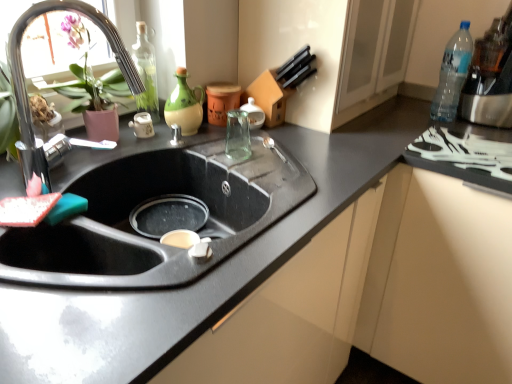
Question: Which direction should I rotate to face green matte jug at upper center, placed as the 2th bottle when sorted from right to left, — up or down?

Choices:
 (A) up
 (B) down

Answer: (A)

Question: From the image's perspective, does matte ceramic teapot at center appear higher than chrome metallic faucet at upper left?

Choices:
 (A) no
 (B) yes

Answer: (A)

Question: Is matte ceramic teapot at center positioned with its back to chrome metallic faucet at upper left?

Choices:
 (A) no
 (B) yes

Answer: (A)

Question: Is matte ceramic teapot at center smaller than chrome metallic faucet at upper left?

Choices:
 (A) yes
 (B) no

Answer: (A)

Question: Is chrome metallic faucet at upper left inside matte ceramic teapot at center?

Choices:
 (A) yes
 (B) no

Answer: (B)

Question: From the image's perspective, does matte ceramic teapot at center appear lower than chrome metallic faucet at upper left?

Choices:
 (A) no
 (B) yes

Answer: (B)

Question: Can you confirm if matte ceramic teapot at center is taller than chrome metallic faucet at upper left?

Choices:
 (A) yes
 (B) no

Answer: (B)

Question: Can you confirm if green matte jug at upper center, placed as the 2th bottle when sorted from right to left, is taller than white plastic tray at right?

Choices:
 (A) yes
 (B) no

Answer: (A)

Question: From the image's perspective, does green matte jug at upper center, placed as the 2th bottle when sorted from right to left, appear lower than white plastic tray at right?

Choices:
 (A) yes
 (B) no

Answer: (B)

Question: Is green matte jug at upper center, placed as the 2th bottle when sorted from right to left, turned away from white plastic tray at right?

Choices:
 (A) no
 (B) yes

Answer: (A)

Question: Does green matte jug at upper center, placed as the 2th bottle when sorted from right to left, lie in front of white plastic tray at right?

Choices:
 (A) no
 (B) yes

Answer: (A)

Question: Is green matte jug at upper center, placed as the 2th bottle when sorted from right to left, to the right of white plastic tray at right from the viewer's perspective?

Choices:
 (A) yes
 (B) no

Answer: (B)

Question: Is green matte jug at upper center, placed as the 2th bottle when sorted from right to left, to the left of white plastic tray at right from the viewer's perspective?

Choices:
 (A) no
 (B) yes

Answer: (B)

Question: Is green matte jug at upper center, which is the second bottle in left-to-right order, taller than clear plastic bottle at upper right, which is the third bottle in left-to-right order?

Choices:
 (A) no
 (B) yes

Answer: (A)